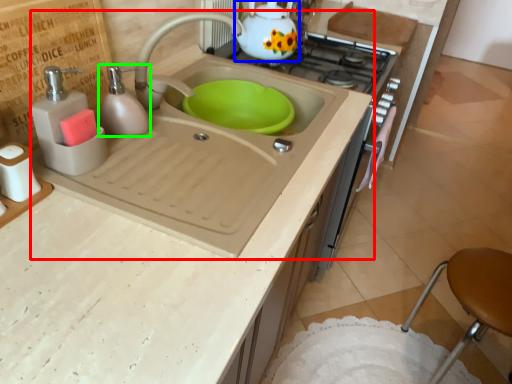
Question: Which is nearer to the sink (highlighted by a red box)? tea pot (highlighted by a blue box) or soap dispenser (highlighted by a green box).

Choices:
 (A) tea pot
 (B) soap dispenser

Answer: (B)